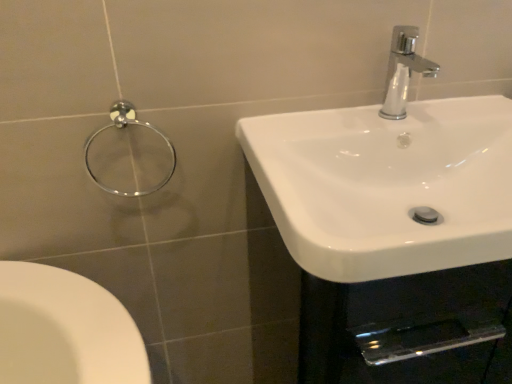
Question: From a real-world perspective, is chrome metallic towel ring at upper left over white glossy sink at right?

Choices:
 (A) no
 (B) yes

Answer: (B)

Question: Is chrome metallic towel ring at upper left positioned with its back to white glossy sink at right?

Choices:
 (A) no
 (B) yes

Answer: (A)

Question: From the image's perspective, is chrome metallic towel ring at upper left under white glossy sink at right?

Choices:
 (A) yes
 (B) no

Answer: (B)

Question: From a real-world perspective, is chrome metallic towel ring at upper left under white glossy sink at right?

Choices:
 (A) yes
 (B) no

Answer: (B)

Question: Is chrome metallic towel ring at upper left to the right of white glossy sink at right from the viewer's perspective?

Choices:
 (A) no
 (B) yes

Answer: (A)

Question: Does chrome metallic towel ring at upper left touch white glossy sink at right?

Choices:
 (A) no
 (B) yes

Answer: (A)

Question: Is white glossy sink at right to the left of chrome metallic towel ring at upper left from the viewer's perspective?

Choices:
 (A) no
 (B) yes

Answer: (A)

Question: Is white glossy sink at right further to the viewer compared to chrome metallic towel ring at upper left?

Choices:
 (A) yes
 (B) no

Answer: (B)

Question: From a real-world perspective, is white glossy sink at right below chrome metallic towel ring at upper left?

Choices:
 (A) no
 (B) yes

Answer: (B)

Question: Is white glossy sink at right touching chrome metallic towel ring at upper left?

Choices:
 (A) no
 (B) yes

Answer: (A)

Question: Considering the relative sizes of white glossy sink at right and chrome metallic towel ring at upper left in the image provided, is white glossy sink at right shorter than chrome metallic towel ring at upper left?

Choices:
 (A) yes
 (B) no

Answer: (A)

Question: Is white glossy sink at right bigger than chrome metallic towel ring at upper left?

Choices:
 (A) yes
 (B) no

Answer: (A)

Question: Is chrome metallic faucet at upper right next to white glossy sink at right and touching it?

Choices:
 (A) yes
 (B) no

Answer: (B)